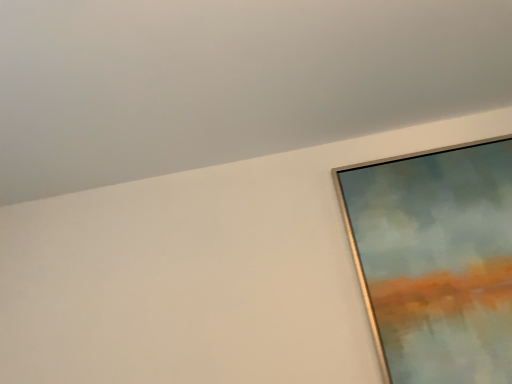
This screenshot has width=512, height=384. Describe the element at coordinates (436, 261) in the screenshot. I see `silver metallic picture frame at upper right` at that location.

You are a GUI agent. You are given a task and a screenshot of the screen. Output one action in this format:
    pyautogui.click(x=<x>, y=<y>)
    Task: Click on the silver metallic picture frame at upper right
    The height and width of the screenshot is (384, 512).
    Given the screenshot: What is the action you would take?
    pyautogui.click(x=436, y=261)

What is the approximate width of silver metallic picture frame at upper right?

The width of silver metallic picture frame at upper right is 1.56 inches.

Where is `silver metallic picture frame at upper right`? Image resolution: width=512 pixels, height=384 pixels. silver metallic picture frame at upper right is located at coordinates (436, 261).